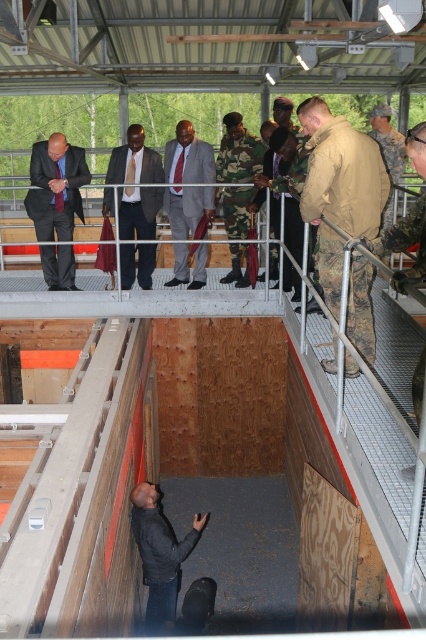
You are a photographer standing on the platform and need to take a photo of both the camouflage uniform at center and the matte black suit at center. Can you fit both subjects into your camera frame if your camera has a maximum field of view of 2 meters?

The camouflage uniform at center and the matte black suit at center are 2.66 meters apart, which exceeds the camera frame of 2 meters, so you cannot fit both subjects into the frame.

From the picture: You are a photographer positioned on the upper level of the platform. You need to take a photo of both the matte black suit at center and the matte gray suit at center. Which one is closer to the camera?

The matte black suit at center is positioned under the matte gray suit at center, so the matte gray suit at center is closer to the camera.

You are a photographer trying to capture a group photo of the matte black suit at left and the matte gray suit at center. Since you want to ensure both are visible, which one should you focus on first to avoid blurring due to their size difference?

The matte black suit at left occupies less space than the matte gray suit at center, so you should focus on the matte gray suit at center first because it is larger and requires more attention to capture details clearly.